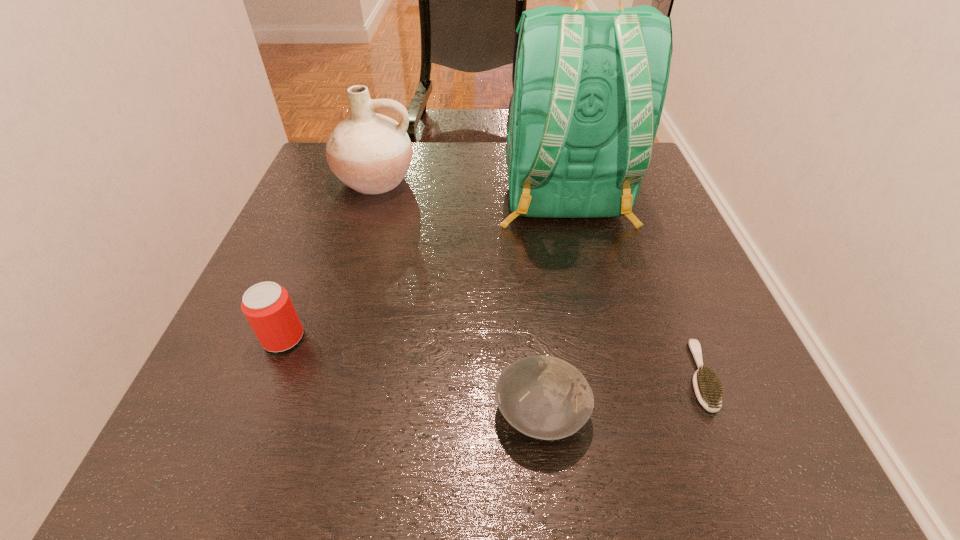
Find the location of a particular element. free point that satisfies the following two spatial constraints: 1. on the back of the scrubbing brush; 2. on the right side of the backpack is located at coordinates (605, 375).

Find the location of a particular element. The image size is (960, 540). blank space that satisfies the following two spatial constraints: 1. to pour from the handle of the second tallest object; 2. on the right side of the bowl is located at coordinates (304, 411).